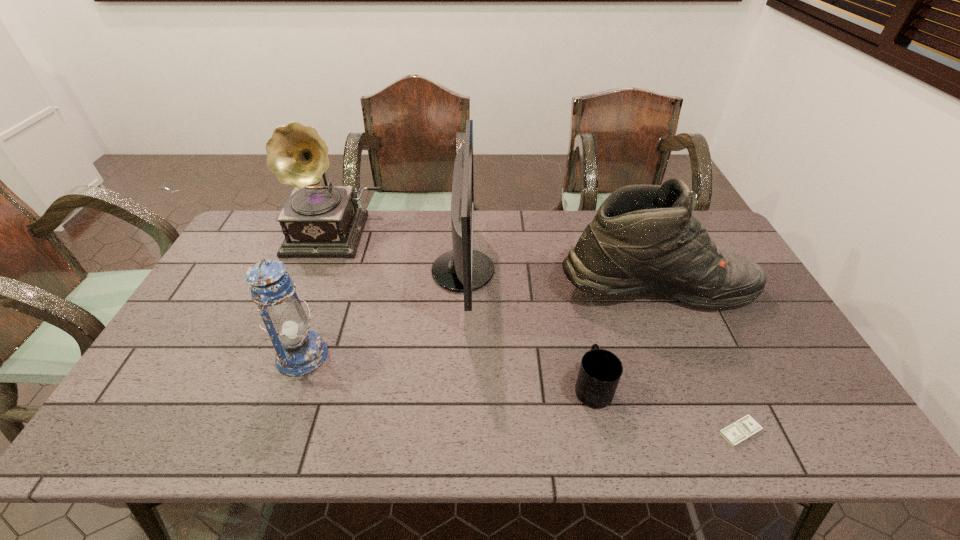
Identify the location of record player. (316, 220).

Image resolution: width=960 pixels, height=540 pixels. I want to click on monitor, so click(x=463, y=269).

Locate an element on the screen. This screenshot has width=960, height=540. ski boot is located at coordinates (644, 237).

Locate an element on the screen. This screenshot has height=540, width=960. lantern is located at coordinates (299, 351).

The image size is (960, 540). I want to click on mug, so click(x=600, y=371).

I want to click on the nearest object, so click(744, 428).

Find the location of `the shortest object`. the shortest object is located at coordinates (744, 428).

Where is `vacant region located 0.230m on the horn of the record player`? The image size is (960, 540). vacant region located 0.230m on the horn of the record player is located at coordinates (305, 310).

Identify the location of vacant space situated 0.070m on the screen side of the third object from left to right. The image size is (960, 540). (516, 271).

This screenshot has width=960, height=540. Find the location of `free space located 0.390m on the left of the ski boot`. free space located 0.390m on the left of the ski boot is located at coordinates (429, 287).